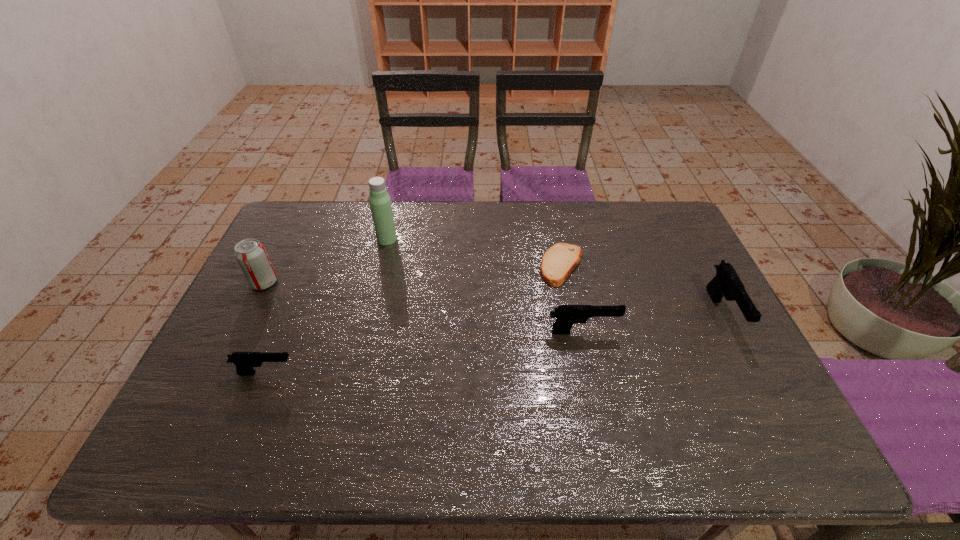
I want to click on free space that is in between the pita bread and the rightmost pistol, so click(x=642, y=289).

At what (x,y) coordinates should I click in order to perform the action: click on free space between the shortest object and the soda can. Please return your answer as a coordinate pair (x, y). This screenshot has height=540, width=960. Looking at the image, I should click on (413, 274).

The height and width of the screenshot is (540, 960). What are the coordinates of `free area in between the soda can and the third shortest object` in the screenshot? It's located at (423, 307).

Image resolution: width=960 pixels, height=540 pixels. In order to click on vacant space that's between the pita bread and the nearest object in this screenshot , I will do `click(414, 319)`.

At what (x,y) coordinates should I click in order to perform the action: click on free space between the soda can and the second pistol from right to left. Please return your answer as a coordinate pair (x, y). This screenshot has height=540, width=960. Looking at the image, I should click on (423, 307).

Identify the location of object that can be found as the third closest to the soda can. The width and height of the screenshot is (960, 540). (559, 261).

Locate an element on the screen. object that ranks as the third closest to the tallest pistol is located at coordinates (380, 202).

Where is `pistol that stands as the closest to the second tallest pistol`? This screenshot has height=540, width=960. pistol that stands as the closest to the second tallest pistol is located at coordinates (727, 283).

In order to click on pistol that is the second closest to the leftmost object in this screenshot , I will do `click(567, 315)`.

I want to click on vacant space that satisfies the following two spatial constraints: 1. on the back side of the leftmost object; 2. on the left side of the fourth object from right to left, so click(x=286, y=239).